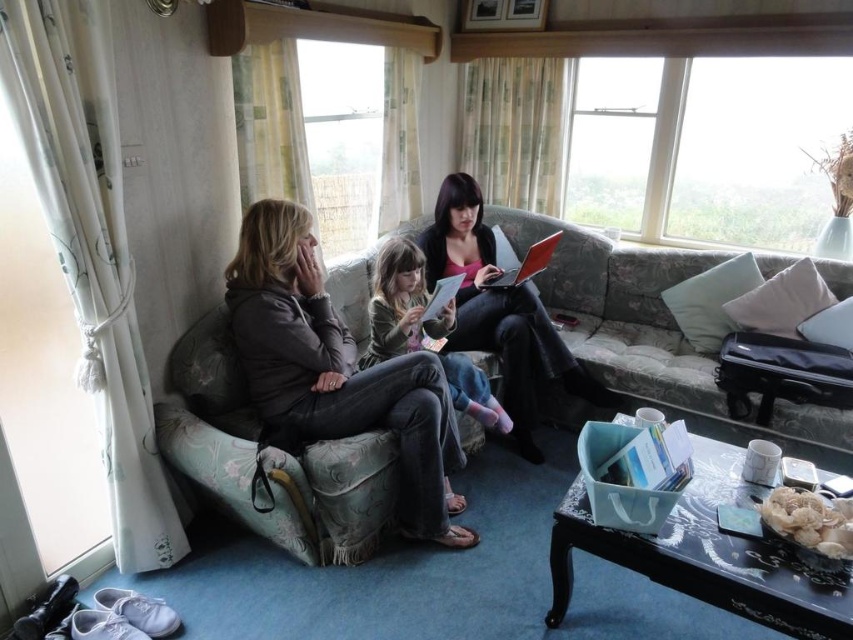
Can you confirm if matte gray sweater at left is shorter than metallic silver laptop at center?

No, matte gray sweater at left is not shorter than metallic silver laptop at center.

Find the location of a particular element. This screenshot has width=853, height=640. matte gray sweater at left is located at coordinates (335, 371).

The image size is (853, 640). What do you see at coordinates (335, 371) in the screenshot?
I see `matte gray sweater at left` at bounding box center [335, 371].

Locate an element on the screen. matte gray sweater at left is located at coordinates (335, 371).

Describe the element at coordinates (498, 312) in the screenshot. I see `matte black laptop at center` at that location.

Is matte black laptop at center positioned at the back of metallic silver laptop at center?

No, matte black laptop at center is in front of metallic silver laptop at center.

Locate an element on the screen. This screenshot has width=853, height=640. matte black laptop at center is located at coordinates (498, 312).

Can you confirm if matte black laptop at center is positioned to the left of white paper book at center?

No, matte black laptop at center is not to the left of white paper book at center.

Measure the distance from matte black laptop at center to white paper book at center.

They are 16.14 inches apart.

Is point (489, 330) closer to camera compared to point (424, 321)?

That is False.

This screenshot has width=853, height=640. Identify the location of matte black laptop at center. (498, 312).